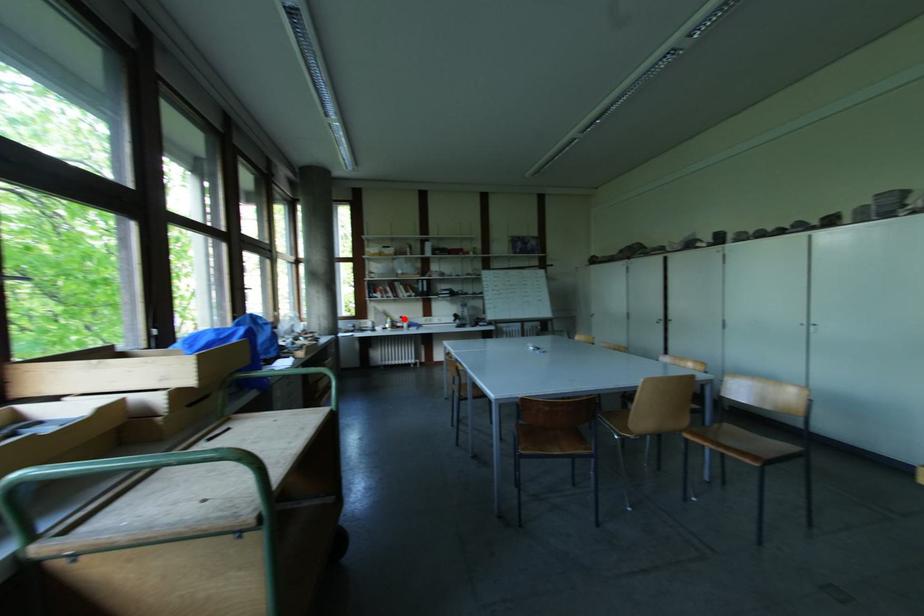
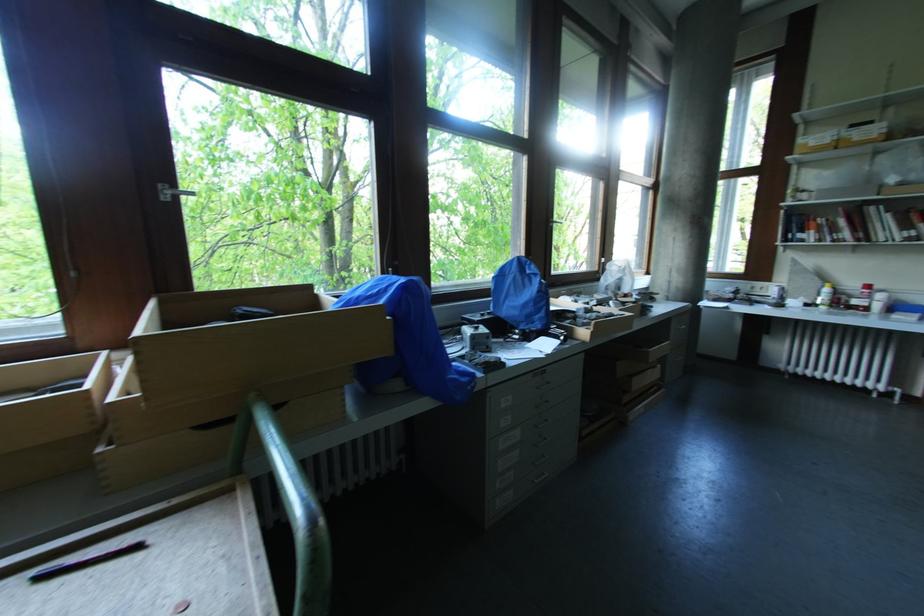
Question: I am providing you with two images of the same scene from different viewpoints. Image1 has a red point marked. In image2, the corresponding 3D location appears at what relative position? Reply with the corresponding letter.

Choices:
 (A) Closer
 (B) Farther

Answer: (B)